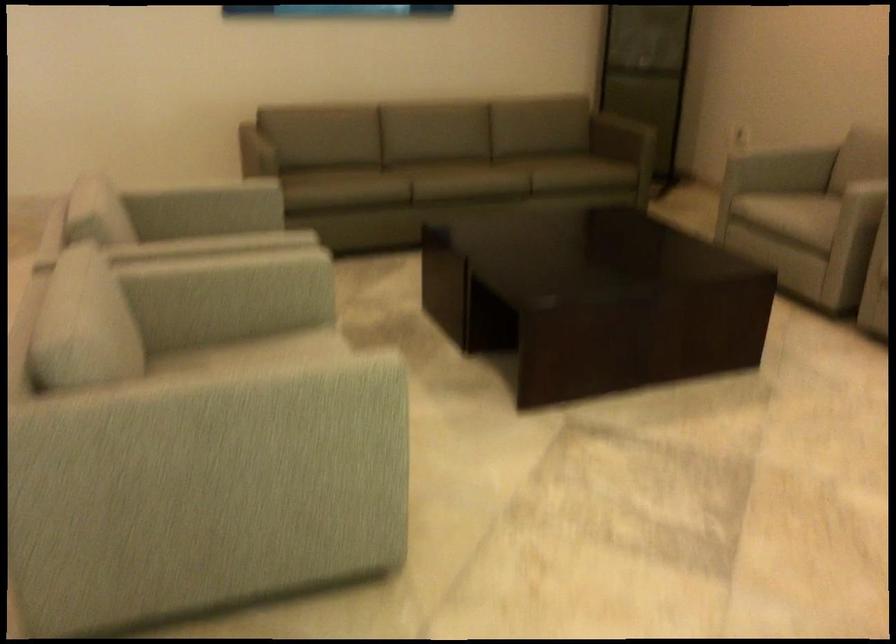
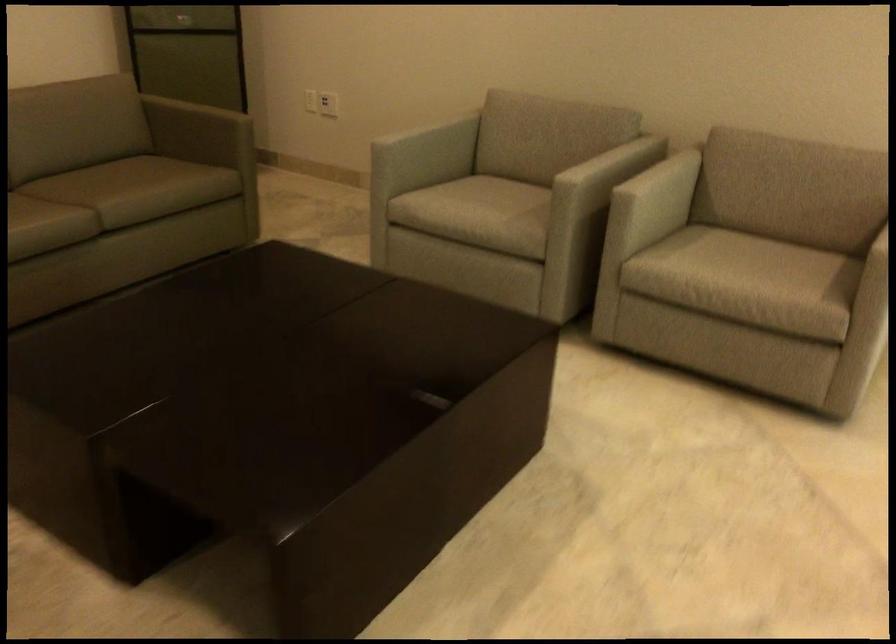
Where in the second image is the point corresponding to point (769, 151) from the first image?

(423, 127)